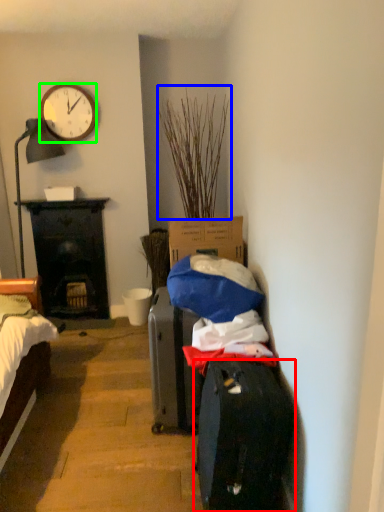
Question: Which object is the farthest from luggage and bags (highlighted by a red box)? Choose among these: plant (highlighted by a blue box) or clock (highlighted by a green box).

Choices:
 (A) plant
 (B) clock

Answer: (B)